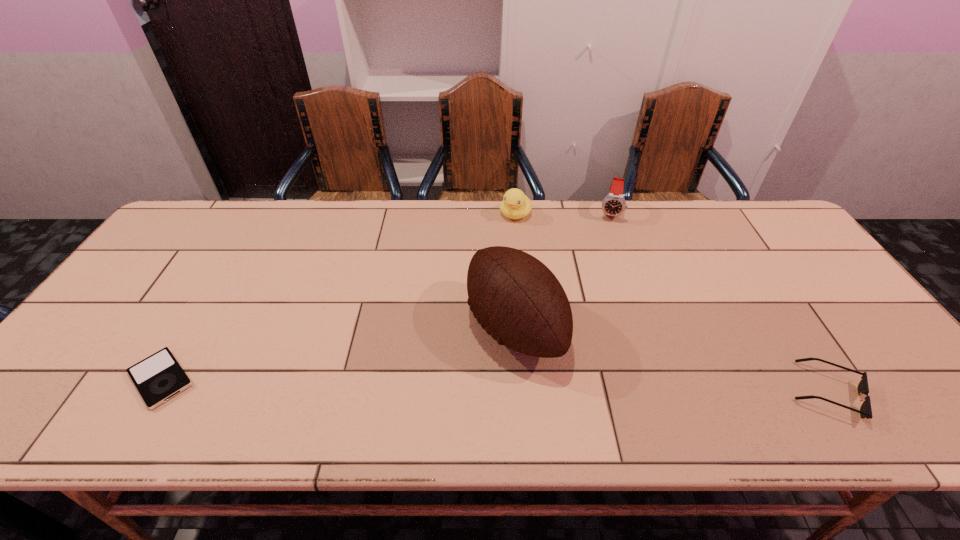
Identify the location of vacant area that satisfies the following two spatial constraints: 1. on the front side of the third shortest object; 2. on the lenses of the fourth tallest object. (533, 392).

Where is `blank area in the image that satisfies the following two spatial constraints: 1. on the front side of the shortest object; 2. on the lenses of the second shortest object`? The height and width of the screenshot is (540, 960). blank area in the image that satisfies the following two spatial constraints: 1. on the front side of the shortest object; 2. on the lenses of the second shortest object is located at coordinates (153, 392).

At what (x,y) coordinates should I click in order to perform the action: click on free point that satisfies the following two spatial constraints: 1. on the front side of the second shortest object; 2. on the lenses of the football. Please return your answer as a coordinate pair (x, y). This screenshot has height=540, width=960. Looking at the image, I should click on (519, 392).

I want to click on vacant space that satisfies the following two spatial constraints: 1. on the front side of the second shortest object; 2. on the lenses of the football, so click(x=519, y=392).

At what (x,y) coordinates should I click in order to perform the action: click on free space that satisfies the following two spatial constraints: 1. on the front side of the rightmost object; 2. on the lenses of the watch. Please return your answer as a coordinate pair (x, y). The width and height of the screenshot is (960, 540). Looking at the image, I should click on (672, 392).

Find the location of `vacant space that satisfies the following two spatial constraints: 1. on the back side of the football; 2. on the right side of the third shortest object`. vacant space that satisfies the following two spatial constraints: 1. on the back side of the football; 2. on the right side of the third shortest object is located at coordinates (507, 214).